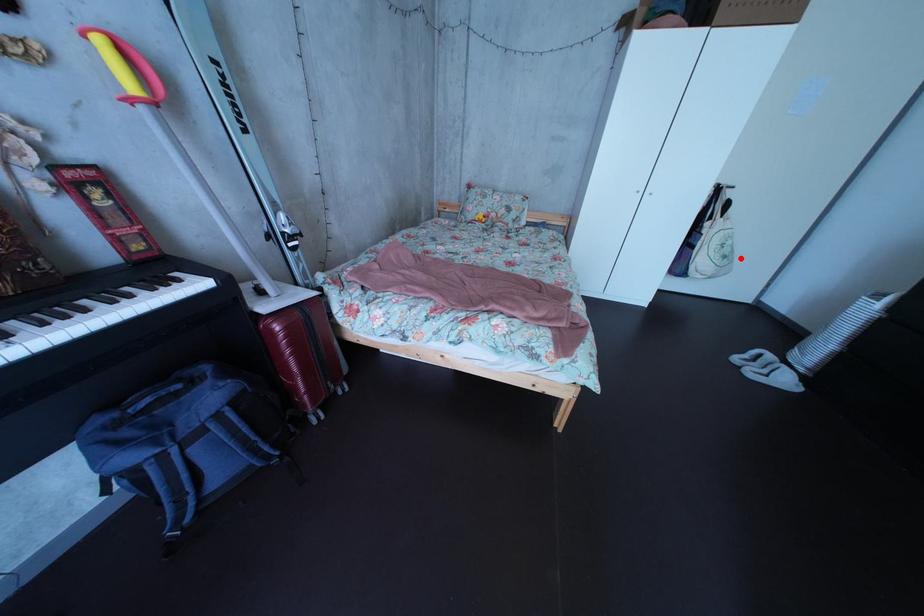
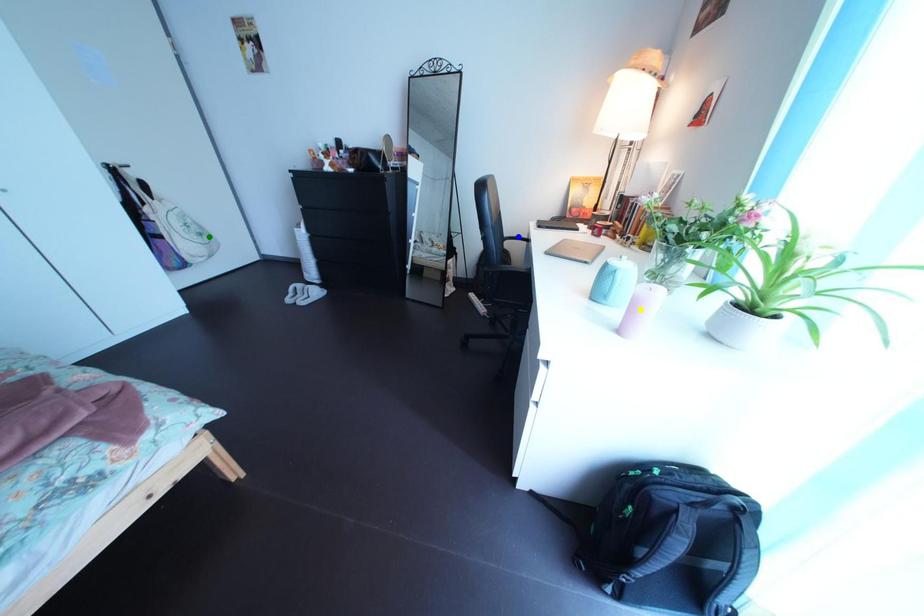
Question: I am providing you with two images of the same scene from different viewpoints. A red point is marked on the first image. You are given multiple points on the second image. Which spot in image 2 lines up with the point in image 1?

Choices:
 (A) blue point
 (B) yellow point
 (C) green point

Answer: (C)